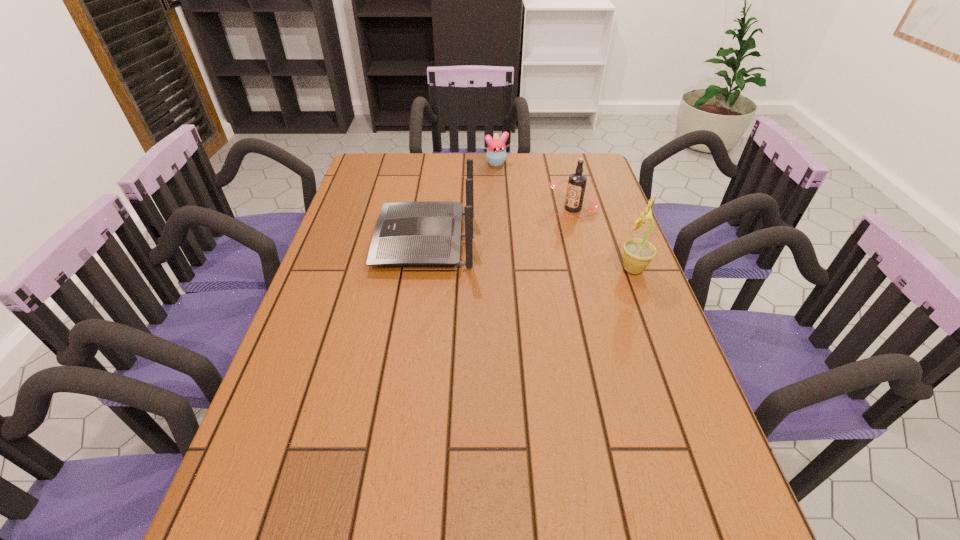
The image size is (960, 540). Find the location of `free spot that satisfies the following two spatial constraints: 1. on the front side of the root beer; 2. on the face of the sunflower`. free spot that satisfies the following two spatial constraints: 1. on the front side of the root beer; 2. on the face of the sunflower is located at coordinates (588, 269).